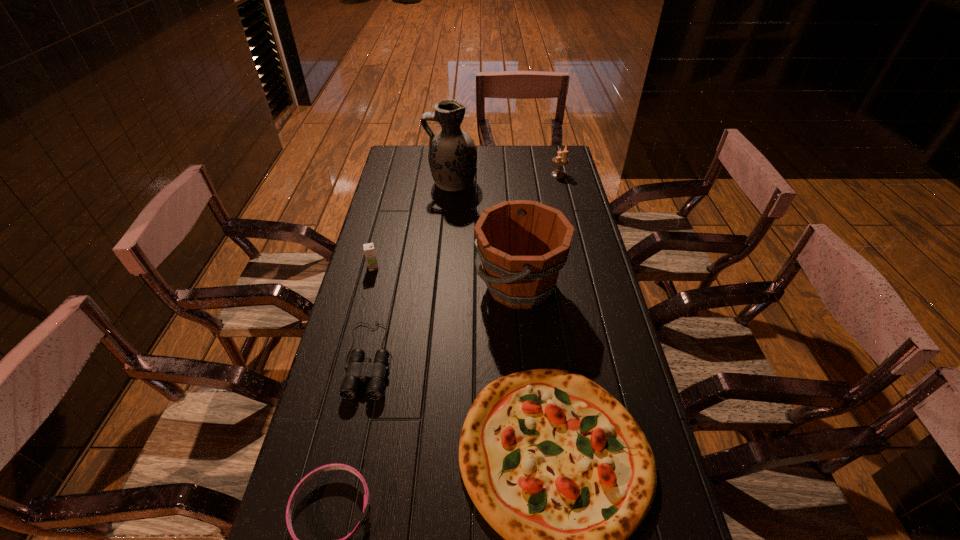
Image resolution: width=960 pixels, height=540 pixels. In order to click on vase in this screenshot , I will do `click(452, 156)`.

Identify the location of bucket. The width and height of the screenshot is (960, 540). (522, 244).

Image resolution: width=960 pixels, height=540 pixels. Find the location of `candle holder`. candle holder is located at coordinates (559, 160).

The width and height of the screenshot is (960, 540). In order to click on chocolate milk in this screenshot , I will do `click(369, 251)`.

Find the location of a particular element. binoculars is located at coordinates (359, 368).

Where is `vacant space located 0.090m with the handle on the side of the tallest object`? Image resolution: width=960 pixels, height=540 pixels. vacant space located 0.090m with the handle on the side of the tallest object is located at coordinates (405, 183).

Locate an element on the screen. The image size is (960, 540). vacant point located with the handle on the side of the tallest object is located at coordinates (407, 183).

At what (x,y) coordinates should I click in order to perform the action: click on vacant space located with the handle on the side of the tallest object. Please return your answer as a coordinate pair (x, y). Looking at the image, I should click on (385, 183).

Where is `free region located on the handle side of the sixth shortest object`? This screenshot has width=960, height=540. free region located on the handle side of the sixth shortest object is located at coordinates (443, 286).

Where is `free space located 0.090m on the handle side of the sixth shortest object`? This screenshot has height=540, width=960. free space located 0.090m on the handle side of the sixth shortest object is located at coordinates (446, 286).